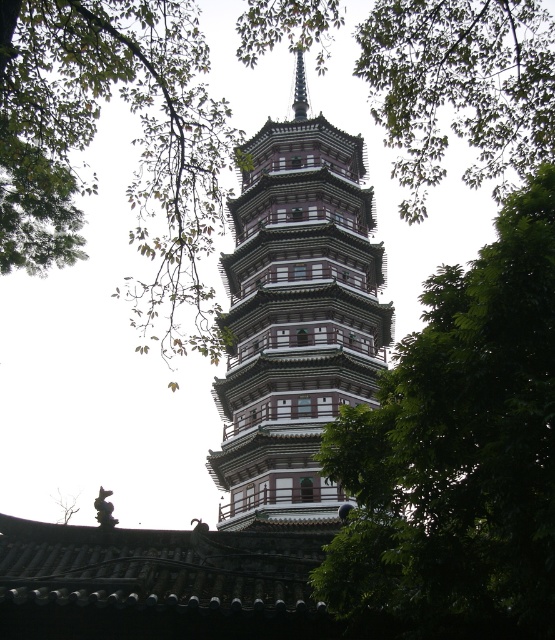
You are standing in a park and see the green leafy tree at center and the white wood tower at center. Which object is closer to you?

The green leafy tree at center is closer to you because it is positioned under the white wood tower at center, indicating it is in front of the tower.

You are a bird looking for a nesting spot. You see a green leafy tree at center and a white wood tower at center. Which structure is shorter for nesting?

The green leafy tree at center is shorter than the white wood tower at center, so it is the better nesting spot.